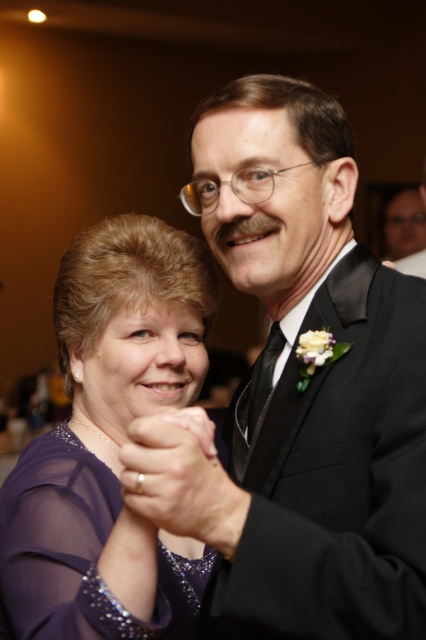
Can you confirm if purple sheer dress at lower left is shorter than purple sheer dress at center?

No, purple sheer dress at lower left is not shorter than purple sheer dress at center.

Can you confirm if purple sheer dress at lower left is positioned to the left of purple sheer dress at center?

Incorrect, purple sheer dress at lower left is not on the left side of purple sheer dress at center.

Between point (94, 538) and point (115, 497), which one is positioned in front?

Point (94, 538) is more forward.

Locate an element on the screen. purple sheer dress at lower left is located at coordinates (109, 444).